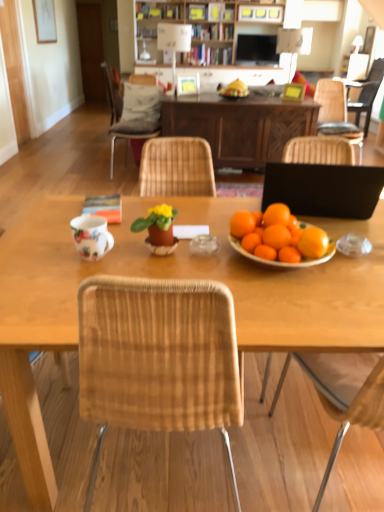
Where is `free spot in front of matte clay pot at center`? free spot in front of matte clay pot at center is located at coordinates (167, 269).